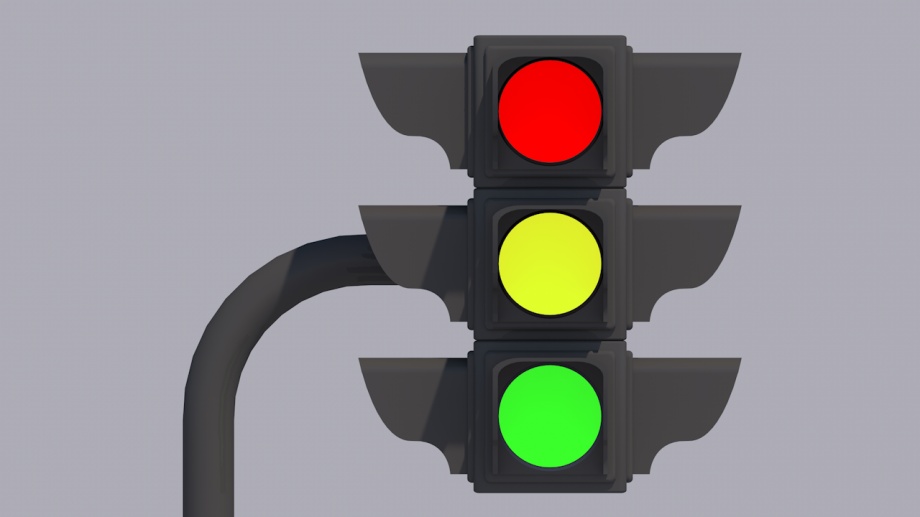
Where is `side panels`? This screenshot has height=517, width=920. side panels is located at coordinates (428, 94), (670, 85), (672, 253), (407, 243), (420, 404), (686, 401).